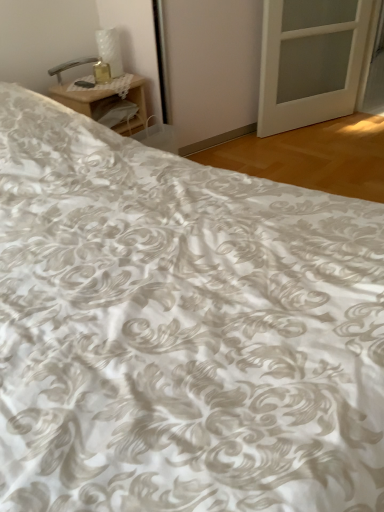
Describe the element at coordinates (71, 66) in the screenshot. I see `metallic silver table lamp at upper left` at that location.

Find the location of a particular element. The image size is (384, 512). metallic silver table lamp at upper left is located at coordinates (71, 66).

The image size is (384, 512). Find the location of `woodennightstand at upper left`. woodennightstand at upper left is located at coordinates (82, 98).

This screenshot has width=384, height=512. What do you see at coordinates (82, 98) in the screenshot? I see `woodennightstand at upper left` at bounding box center [82, 98].

What is the approximate width of woodennightstand at upper left?

The width of woodennightstand at upper left is 12.87 inches.

Find the location of a particular element. Image resolution: width=384 pixels, height=512 pixels. metallic silver table lamp at upper left is located at coordinates (71, 66).

Considering the relative positions of metallic silver table lamp at upper left and woodennightstand at upper left in the image provided, is metallic silver table lamp at upper left to the left or to the right of woodennightstand at upper left?

metallic silver table lamp at upper left is positioned on woodennightstand at upper left's left side.

Which object is closer to the camera taking this photo, metallic silver table lamp at upper left or woodennightstand at upper left?

woodennightstand at upper left is more forward.

Is point (73, 65) farther from viewer compared to point (131, 80)?

Yes, it is.

From the image's perspective, which one is positioned higher, metallic silver table lamp at upper left or woodennightstand at upper left?

metallic silver table lamp at upper left is shown above in the image.

From a real-world perspective, between metallic silver table lamp at upper left and woodennightstand at upper left, who is vertically higher?

In real-world perspective, metallic silver table lamp at upper left is above.

Considering the relative sizes of metallic silver table lamp at upper left and woodennightstand at upper left in the image provided, is metallic silver table lamp at upper left thinner than woodennightstand at upper left?

Yes.

Consider the image. Considering the sizes of metallic silver table lamp at upper left and woodennightstand at upper left in the image, is metallic silver table lamp at upper left taller or shorter than woodennightstand at upper left?

Considering their sizes, metallic silver table lamp at upper left has less height than woodennightstand at upper left.

Which of these two, metallic silver table lamp at upper left or woodennightstand at upper left, is bigger?

Bigger between the two is woodennightstand at upper left.

Is metallic silver table lamp at upper left positioned beyond the bounds of woodennightstand at upper left?

That's correct, metallic silver table lamp at upper left is outside of woodennightstand at upper left.

Is metallic silver table lamp at upper left far away from woodennightstand at upper left?

No, metallic silver table lamp at upper left is not far away from woodennightstand at upper left.

Is metallic silver table lamp at upper left oriented away from woodennightstand at upper left?

No, woodennightstand at upper left is not at the back of metallic silver table lamp at upper left.

How many degrees apart are the facing directions of metallic silver table lamp at upper left and woodennightstand at upper left?

They differ by 0.073 degrees in their facing directions.

Measure the distance from metallic silver table lamp at upper left to woodennightstand at upper left.

A distance of 27.94 centimeters exists between metallic silver table lamp at upper left and woodennightstand at upper left.

Where is `table lamp on the left of woodennightstand at upper left`? This screenshot has width=384, height=512. table lamp on the left of woodennightstand at upper left is located at coordinates (71, 66).

In the image, is woodennightstand at upper left on the left side or the right side of metallic silver table lamp at upper left?

From the image, it's evident that woodennightstand at upper left is to the right of metallic silver table lamp at upper left.

Is woodennightstand at upper left behind metallic silver table lamp at upper left?

No.

Does point (96, 89) lie in front of point (88, 59)?

Yes.

From the image's perspective, is woodennightstand at upper left located above metallic silver table lamp at upper left?

No, from the image's perspective, woodennightstand at upper left is not over metallic silver table lamp at upper left.

From a real-world perspective, is woodennightstand at upper left on metallic silver table lamp at upper left?

No, from a real-world perspective, woodennightstand at upper left is not over metallic silver table lamp at upper left

Consider the image. Between woodennightstand at upper left and metallic silver table lamp at upper left, which one has smaller width?

metallic silver table lamp at upper left.

Which of these two, woodennightstand at upper left or metallic silver table lamp at upper left, stands taller?

Standing taller between the two is woodennightstand at upper left.

Who is smaller, woodennightstand at upper left or metallic silver table lamp at upper left?

With smaller size is metallic silver table lamp at upper left.

Would you say metallic silver table lamp at upper left is part of woodennightstand at upper left's contents?

No, metallic silver table lamp at upper left is not a part of woodennightstand at upper left.

Is there a large distance between woodennightstand at upper left and metallic silver table lamp at upper left?

No, there isn't a large distance between woodennightstand at upper left and metallic silver table lamp at upper left.

Is woodennightstand at upper left turned away from metallic silver table lamp at upper left?

No, woodennightstand at upper left's orientation is not away from metallic silver table lamp at upper left.

Can you tell me how much woodennightstand at upper left and metallic silver table lamp at upper left differ in facing direction?

woodennightstand at upper left and metallic silver table lamp at upper left are facing 0.073 degrees away from each other.

The width and height of the screenshot is (384, 512). In order to click on table lamp above the woodennightstand at upper left (from the image's perspective) in this screenshot , I will do `click(71, 66)`.

At what (x,y) coordinates should I click in order to perform the action: click on nightstand lying on the right of metallic silver table lamp at upper left. Please return your answer as a coordinate pair (x, y). This screenshot has width=384, height=512. Looking at the image, I should click on (82, 98).

Locate an element on the screen. table lamp lying behind the woodennightstand at upper left is located at coordinates (71, 66).